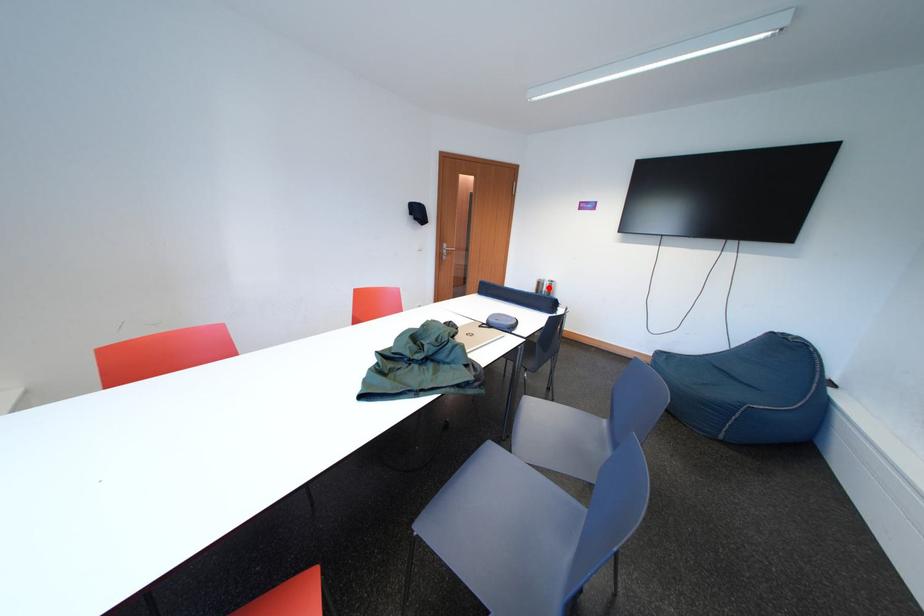
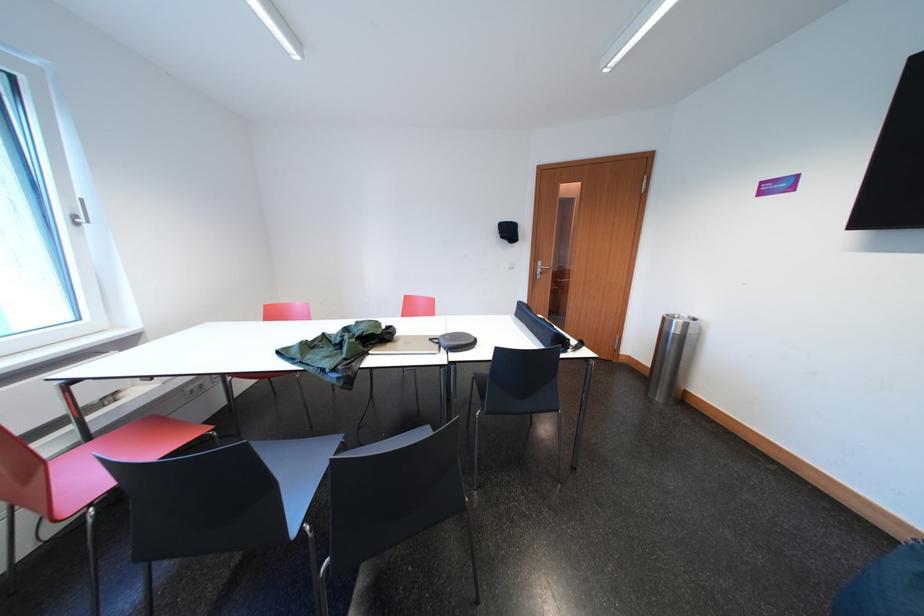
Question: A red point is marked in image1. In image2, is the corresponding 3D point closer to the camera or farther? Reply with the corresponding letter.

Choices:
 (A) The corresponding 3D point is closer.
 (B) The corresponding 3D point is farther.

Answer: (B)